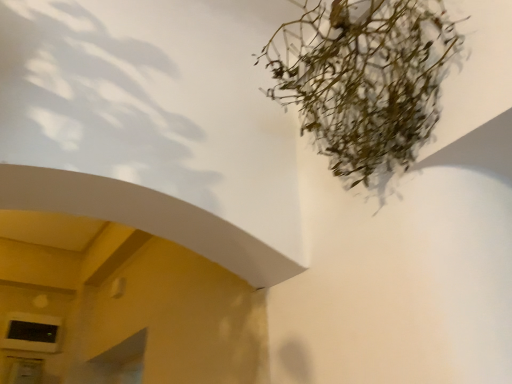
Question: From the image's perspective, is matte black window at lower left on top of green matte plant at upper right?

Choices:
 (A) no
 (B) yes

Answer: (A)

Question: Is matte black window at lower left positioned before green matte plant at upper right?

Choices:
 (A) yes
 (B) no

Answer: (B)

Question: Is green matte plant at upper right a part of matte black window at lower left?

Choices:
 (A) no
 (B) yes

Answer: (A)

Question: Considering the relative sizes of matte black window at lower left and green matte plant at upper right in the image provided, is matte black window at lower left thinner than green matte plant at upper right?

Choices:
 (A) no
 (B) yes

Answer: (B)

Question: Is matte black window at lower left not within green matte plant at upper right?

Choices:
 (A) no
 (B) yes

Answer: (B)

Question: Considering the relative sizes of matte black window at lower left and green matte plant at upper right in the image provided, is matte black window at lower left wider than green matte plant at upper right?

Choices:
 (A) no
 (B) yes

Answer: (A)

Question: Considering the relative sizes of green matte plant at upper right and matte black window at lower left in the image provided, is green matte plant at upper right thinner than matte black window at lower left?

Choices:
 (A) yes
 (B) no

Answer: (B)

Question: Is green matte plant at upper right completely or partially outside of matte black window at lower left?

Choices:
 (A) no
 (B) yes

Answer: (B)

Question: From the image's perspective, is green matte plant at upper right on matte black window at lower left?

Choices:
 (A) yes
 (B) no

Answer: (A)

Question: Is green matte plant at upper right with matte black window at lower left?

Choices:
 (A) no
 (B) yes

Answer: (A)

Question: Is green matte plant at upper right bigger than matte black window at lower left?

Choices:
 (A) yes
 (B) no

Answer: (A)

Question: Does green matte plant at upper right have a greater height compared to matte black window at lower left?

Choices:
 (A) yes
 (B) no

Answer: (A)

Question: Relative to matte black window at lower left, is green matte plant at upper right in front or behind?

Choices:
 (A) front
 (B) behind

Answer: (A)